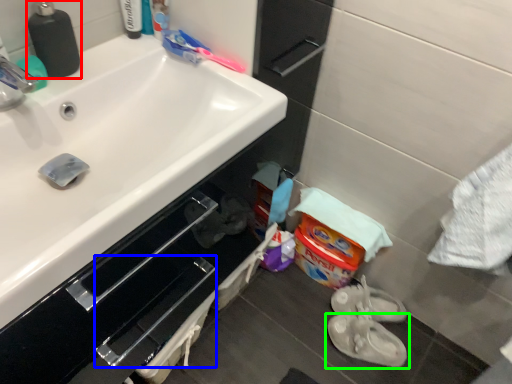
Question: Estimate the real-world distances between objects in this image. Which object is closer to soap dispenser (highlighted by a red box), drawer (highlighted by a blue box) or footwear (highlighted by a green box)?

Choices:
 (A) drawer
 (B) footwear

Answer: (A)